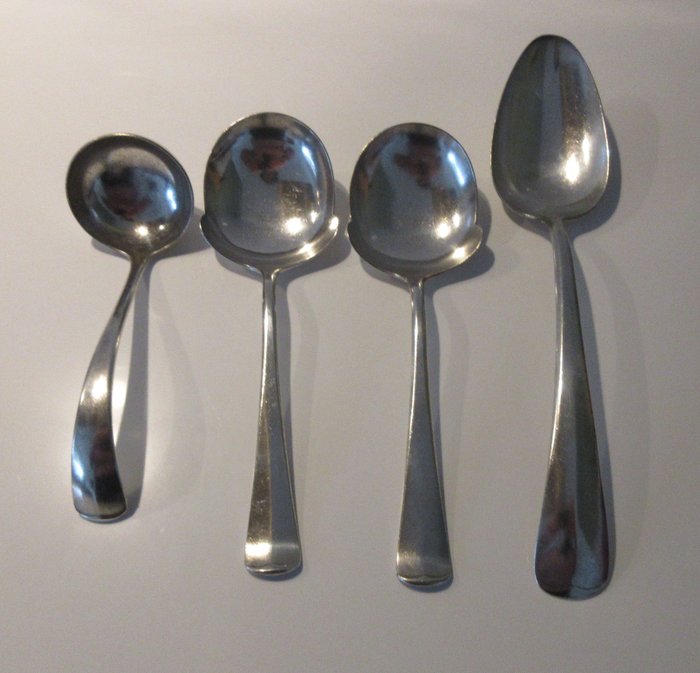
Locate an element on the screen. Image resolution: width=700 pixels, height=673 pixels. spoons is located at coordinates (139, 213), (272, 194), (424, 202), (558, 149).